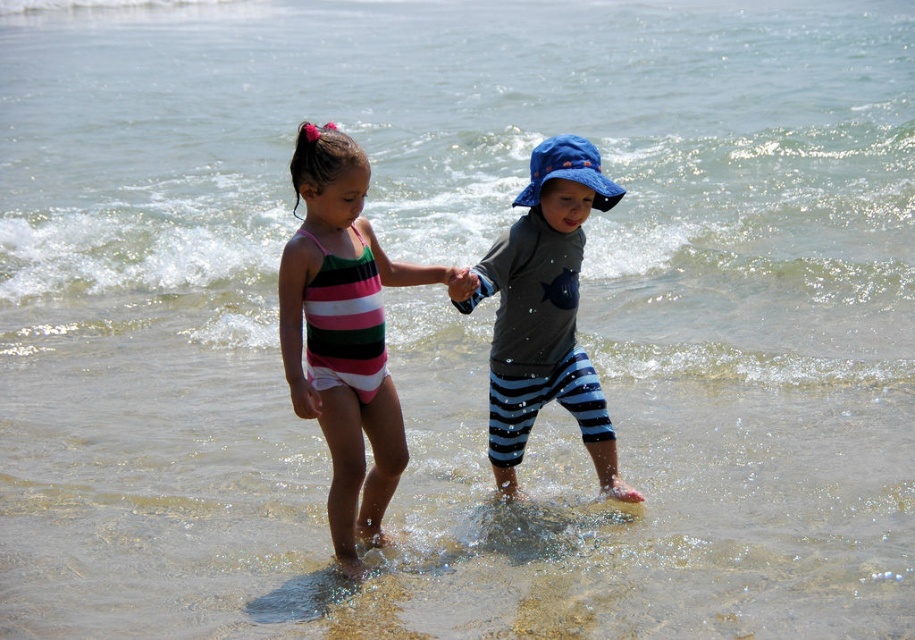
You are a photographer trying to capture the blue bucket hat with orange trim that the child on the right is wearing. You notice a point marked at coordinates (545,312). Based on the scene description, where exactly is this point located on the blue bucket hat at center?

The point at coordinates (545,312) is located on the blue bucket hat at center.